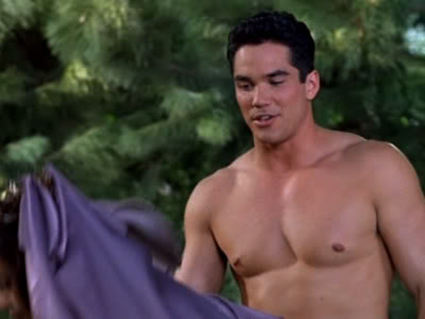
This screenshot has height=319, width=425. I want to click on the chest, so click(284, 206).